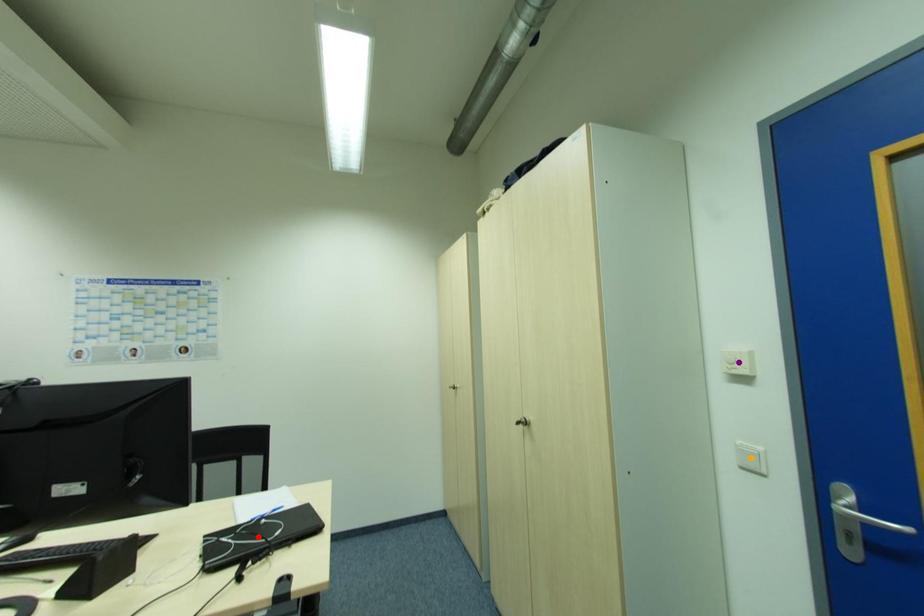
Order these from nearest to farthest:
red point
purple point
orange point

red point, purple point, orange point